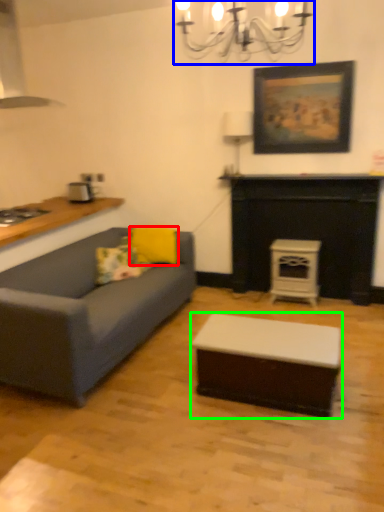
Question: Which object is positioned closest to pillow (highlighted by a red box)? Select from light fixture (highlighted by a blue box) and coffee table (highlighted by a green box).

Choices:
 (A) light fixture
 (B) coffee table

Answer: (B)